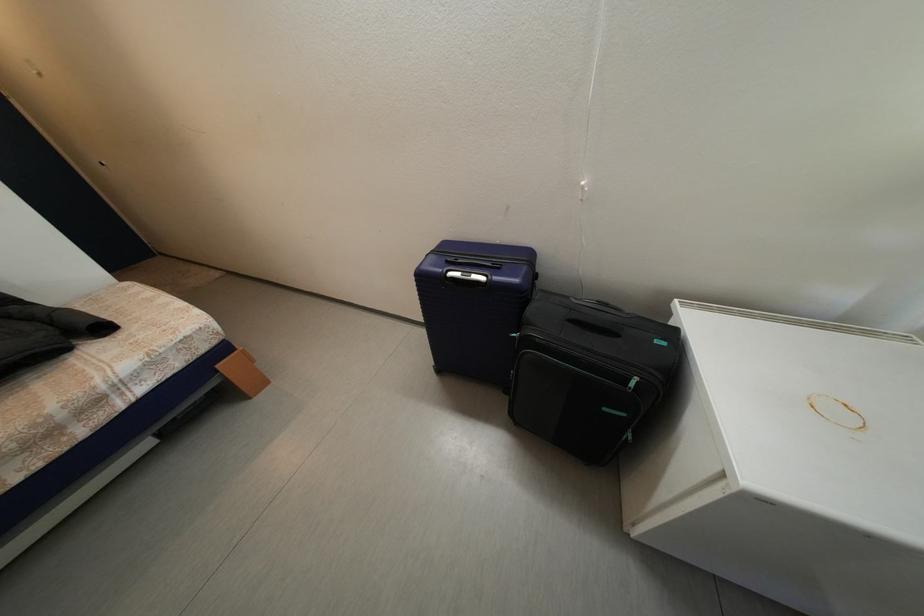
Identify the location of green zipper pull. (633, 383).